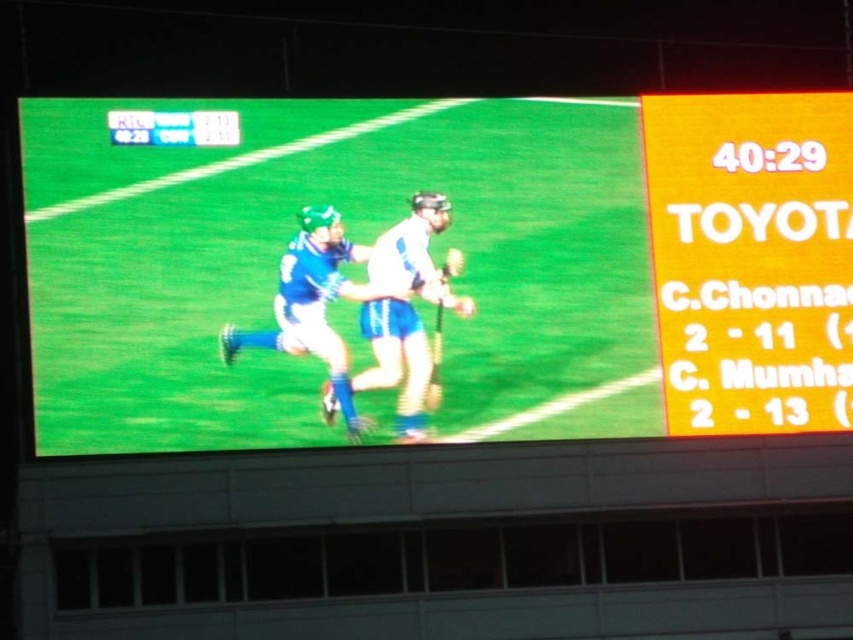
Is matte blue shorts at center thinner than blue fabric jersey at center?

Incorrect, matte blue shorts at center's width is not less than blue fabric jersey at center's.

Between point (641, 232) and point (315, 230), which one is positioned in front?

Point (315, 230) is in front.

Does point (378, 340) come behind point (351, 435)?

That is True.

Where is `matte blue shorts at center`? This screenshot has width=853, height=640. matte blue shorts at center is located at coordinates (438, 268).

Is point (389, 240) positioned after point (358, 296)?

Yes.

Image resolution: width=853 pixels, height=640 pixels. Identify the location of white matte jersey at center. (397, 362).

Describe the element at coordinates (438, 268) in the screenshot. This screenshot has height=640, width=853. I see `matte blue shorts at center` at that location.

Measure the distance between matte blue shorts at center and white matte jersey at center.

A distance of 6.46 meters exists between matte blue shorts at center and white matte jersey at center.

What do you see at coordinates (438, 268) in the screenshot? I see `matte blue shorts at center` at bounding box center [438, 268].

Identify the location of matte blue shorts at center. The width and height of the screenshot is (853, 640). (438, 268).